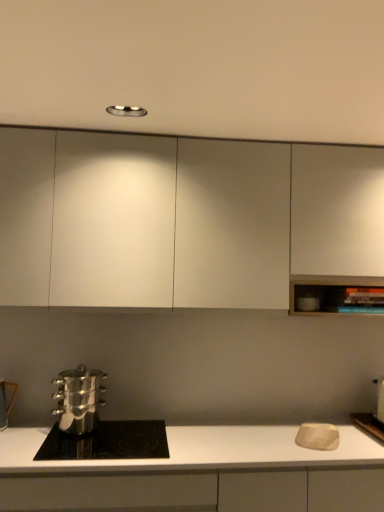
This screenshot has height=512, width=384. I want to click on free point above polished stainless steel pot at lower left (from a real-world perspective), so click(112, 439).